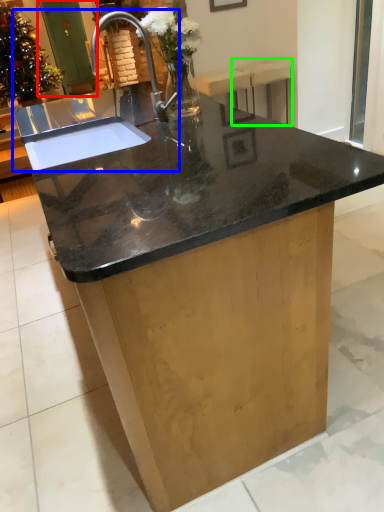
Question: Estimate the real-world distances between objects in this image. Which object is farther from screen door (highlighted by a red box), sink (highlighted by a blue box) or bar stool (highlighted by a green box)?

Choices:
 (A) sink
 (B) bar stool

Answer: (A)